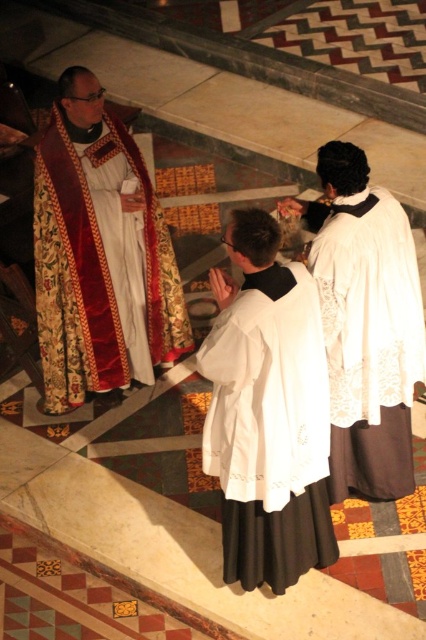
Question: Observing the image, what is the correct spatial positioning of white embroidered robe at center in reference to white lace robe at upper right?

Choices:
 (A) left
 (B) right

Answer: (A)

Question: Can you confirm if white embroidered robe at center is positioned above white lace robe at upper right?

Choices:
 (A) no
 (B) yes

Answer: (A)

Question: Which point is farther from the camera taking this photo?

Choices:
 (A) (51, 282)
 (B) (290, 321)

Answer: (A)

Question: Which point is closer to the camera?

Choices:
 (A) (301, 337)
 (B) (409, 452)

Answer: (A)

Question: Does velvet red and gold robe at upper left have a larger size compared to white embroidered robe at center?

Choices:
 (A) no
 (B) yes

Answer: (B)

Question: Which point is closer to the camera taking this photo?

Choices:
 (A) (307, 557)
 (B) (368, 307)
 (C) (155, 224)

Answer: (B)